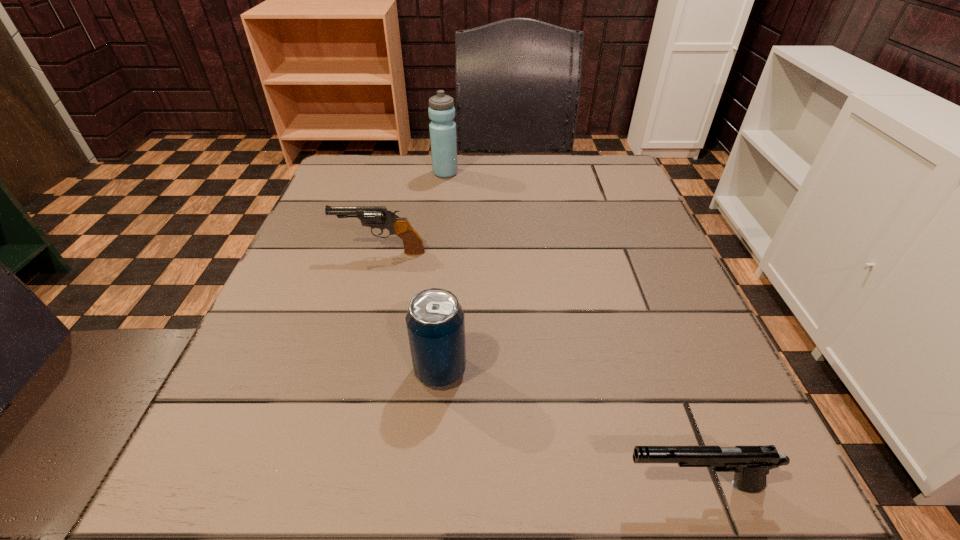
Locate an element on the screen. This screenshot has width=960, height=540. object that is at the near right corner is located at coordinates 751,464.

Locate an element on the screen. free location at the far edge of the desktop is located at coordinates tap(401, 167).

Locate an element on the screen. Image resolution: width=960 pixels, height=540 pixels. vacant position at the near edge of the desktop is located at coordinates (438, 514).

At what (x,y) coordinates should I click in order to perform the action: click on vacant space at the left edge. Please return your answer as a coordinate pair (x, y). Image resolution: width=960 pixels, height=540 pixels. Looking at the image, I should click on (292, 273).

Find the location of `blank area at the right edge`. blank area at the right edge is located at coordinates (579, 219).

The width and height of the screenshot is (960, 540). What are the coordinates of `vacant space at the near left corner` in the screenshot? It's located at (318, 456).

Image resolution: width=960 pixels, height=540 pixels. In order to click on free space at the far right corner of the desktop in this screenshot , I will do `click(620, 160)`.

Where is `free region at the near right corner of the desktop`? free region at the near right corner of the desktop is located at coordinates (688, 479).

Locate an element on the screen. The height and width of the screenshot is (540, 960). free spot between the second tallest object and the right gun is located at coordinates (566, 428).

Find the location of a particular element. Image resolution: width=960 pixels, height=540 pixels. free point between the farther gun and the tallest object is located at coordinates (413, 213).